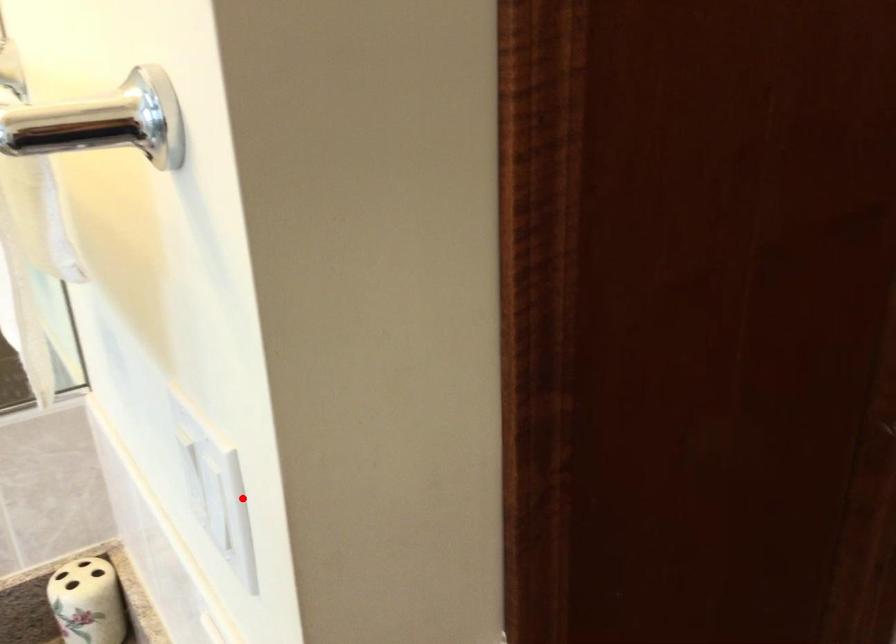
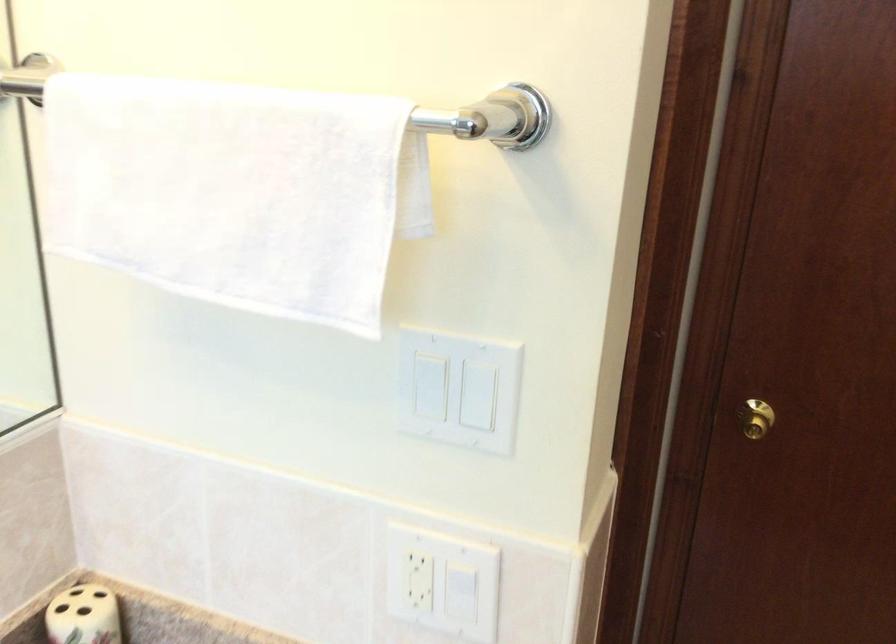
Question: I am providing you with two images of the same scene from different viewpoints. A red point is marked on the first image. At the location where the point appears in image 1, is it still visible in image 2?

Choices:
 (A) Yes
 (B) No

Answer: (A)